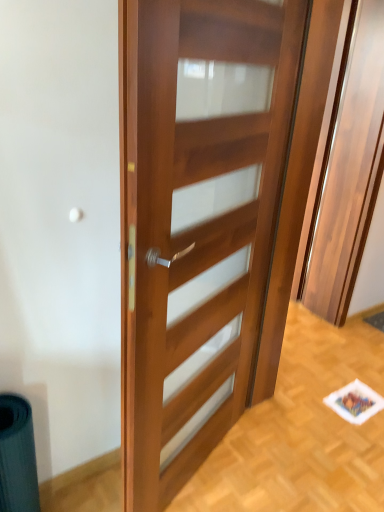
Describe the element at coordinates (196, 219) in the screenshot. The height and width of the screenshot is (512, 384). I see `wooden door at center` at that location.

Find the location of a particular element. wooden door at center is located at coordinates (196, 219).

Describe the element at coordinates (349, 168) in the screenshot. I see `wooden door at center` at that location.

The height and width of the screenshot is (512, 384). Identify the location of wooden door at center. (349, 168).

What is the approximate height of wooden door at center?

It is 6.34 feet.

Locate an element on the screen. The height and width of the screenshot is (512, 384). wooden door at center is located at coordinates (196, 219).

Considering the positions of objects wooden door at center and wooden door at center in the image provided, who is more to the left, wooden door at center or wooden door at center?

From the viewer's perspective, wooden door at center appears more on the left side.

Considering the positions of objects wooden door at center and wooden door at center in the image provided, who is in front, wooden door at center or wooden door at center?

wooden door at center.

Which is farther from the camera, (383,116) or (139,92)?

The point (383,116) is farther.

From the image's perspective, between wooden door at center and wooden door at center, which one is located above?

wooden door at center.

From a real-world perspective, is wooden door at center beneath wooden door at center?

Actually, wooden door at center is physically above wooden door at center in the real world.

Is wooden door at center wider than wooden door at center?

Correct, the width of wooden door at center exceeds that of wooden door at center.

Can you confirm if wooden door at center is taller than wooden door at center?

Correct, wooden door at center is much taller as wooden door at center.

Based on their sizes in the image, would you say wooden door at center is bigger or smaller than wooden door at center?

wooden door at center is bigger than wooden door at center.

Is wooden door at center spatially inside wooden door at center, or outside of it?

wooden door at center is not inside wooden door at center, it's outside.

Is there a large distance between wooden door at center and wooden door at center?

Yes, wooden door at center and wooden door at center are quite far apart.

Is wooden door at center looking in the opposite direction of wooden door at center?

wooden door at center is not turned away from wooden door at center.

Based on the photo, how different are the orientations of wooden door at center and wooden door at center in degrees?

wooden door at center and wooden door at center are facing 19.2 degrees away from each other.

At what (x,y) coordinates should I click in order to perform the action: click on elevator located behind the wooden door at center. Please return your answer as a coordinate pair (x, y). The image size is (384, 512). Looking at the image, I should click on (349, 168).

Based on the photo, considering the positions of objects wooden door at center and wooden door at center in the image provided, who is more to the left, wooden door at center or wooden door at center?

wooden door at center is more to the left.

Is wooden door at center further to camera compared to wooden door at center?

That is False.

Which point is more distant from viewer, (213, 357) or (368, 96)?

The point (368, 96) is farther.

From the image's perspective, is wooden door at center positioned above or below wooden door at center?

wooden door at center is situated lower than wooden door at center in the image.

From a real-world perspective, is wooden door at center above or below wooden door at center?

In terms of real-world spatial position, wooden door at center is below wooden door at center.

Is wooden door at center wider or thinner than wooden door at center?

Considering their sizes, wooden door at center looks slimmer than wooden door at center.

Can you confirm if wooden door at center is taller than wooden door at center?

No, wooden door at center is not taller than wooden door at center.

Can you confirm if wooden door at center is smaller than wooden door at center?

Correct, wooden door at center occupies less space than wooden door at center.

Which is correct: wooden door at center is inside wooden door at center, or outside of it?

wooden door at center is located beyond the bounds of wooden door at center.

Are wooden door at center and wooden door at center far apart?

That's right, there is a large distance between wooden door at center and wooden door at center.

Is wooden door at center looking in the opposite direction of wooden door at center?

No, wooden door at center is not facing the opposite direction of wooden door at center.

What's the angular difference between wooden door at center and wooden door at center's facing directions?

19.2 degrees separate the facing orientations of wooden door at center and wooden door at center.

Find the location of a particular element. The height and width of the screenshot is (512, 384). door on the left of wooden door at center is located at coordinates (196, 219).

The height and width of the screenshot is (512, 384). I want to click on door on the left of wooden door at center, so click(196, 219).

At what (x,y) coordinates should I click in order to perform the action: click on elevator above the wooden door at center (from the image's perspective). Please return your answer as a coordinate pair (x, y). The height and width of the screenshot is (512, 384). Looking at the image, I should click on (349, 168).